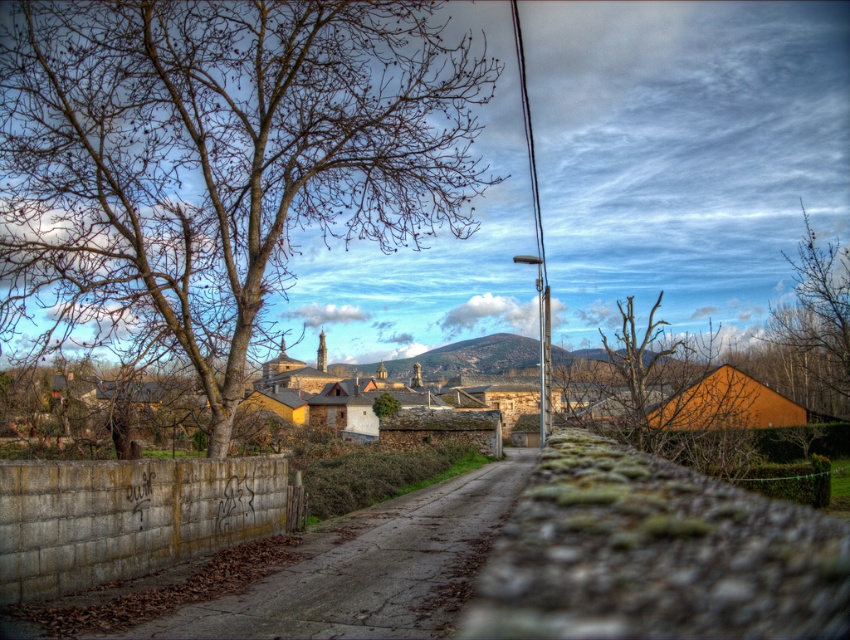
Question: Which object appears closest to the camera in this image?

Choices:
 (A) bare wood tree at left
 (B) bare branches at right
 (C) bare branches at center

Answer: (A)

Question: Does bare wood tree at left appear on the right side of bare branches at right?

Choices:
 (A) no
 (B) yes

Answer: (A)

Question: Which is farther from the bare branches at right?

Choices:
 (A) bare branches at center
 (B) bare wood tree at left

Answer: (B)

Question: Is the position of bare wood tree at left less distant than that of bare branches at center?

Choices:
 (A) yes
 (B) no

Answer: (A)

Question: Can you confirm if bare wood tree at left is smaller than bare branches at center?

Choices:
 (A) no
 (B) yes

Answer: (A)

Question: Which point is farther from the camera taking this photo?

Choices:
 (A) (701, 365)
 (B) (823, 289)
 (C) (21, 193)

Answer: (B)